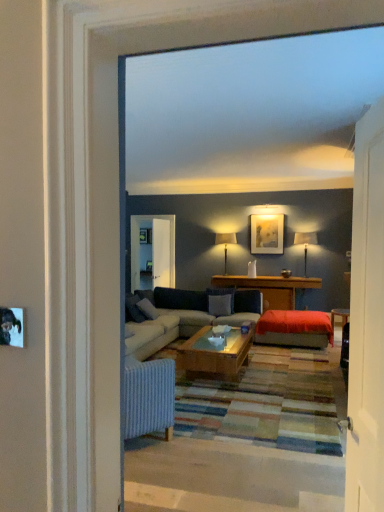
Question: Can you confirm if matte gold picture frame at upper center is wider than wooden table at center?

Choices:
 (A) yes
 (B) no

Answer: (B)

Question: Considering the relative positions of matte gold picture frame at upper center and wooden table at center in the image provided, is matte gold picture frame at upper center behind wooden table at center?

Choices:
 (A) yes
 (B) no

Answer: (A)

Question: Is wooden table at center at the back of matte gold picture frame at upper center?

Choices:
 (A) yes
 (B) no

Answer: (B)

Question: Could wooden table at center be considered to be inside matte gold picture frame at upper center?

Choices:
 (A) no
 (B) yes

Answer: (A)

Question: Can you confirm if matte gold picture frame at upper center is smaller than wooden table at center?

Choices:
 (A) no
 (B) yes

Answer: (B)

Question: In the image, is white wooden door at right positioned in front of or behind matte black lampshade at center, which ranks as the first lamp in left-to-right order?

Choices:
 (A) behind
 (B) front

Answer: (B)

Question: Is white wooden door at right taller or shorter than matte black lampshade at center, marked as the first lamp in a back-to-front arrangement?

Choices:
 (A) short
 (B) tall

Answer: (B)

Question: Considering the positions of white wooden door at right and matte black lampshade at center, which ranks as the first lamp in left-to-right order, in the image, is white wooden door at right wider or thinner than matte black lampshade at center, which ranks as the first lamp in left-to-right order,?

Choices:
 (A) wide
 (B) thin

Answer: (B)

Question: From a real-world perspective, is white wooden door at right positioned above or below matte black lampshade at center, marked as the first lamp in a back-to-front arrangement?

Choices:
 (A) above
 (B) below

Answer: (B)

Question: Visually, is clear glass screen door at center positioned to the left or to the right of matte gold picture frame at upper center?

Choices:
 (A) left
 (B) right

Answer: (A)

Question: Relative to matte gold picture frame at upper center, is clear glass screen door at center in front or behind?

Choices:
 (A) front
 (B) behind

Answer: (A)

Question: From a real-world perspective, relative to matte gold picture frame at upper center, is clear glass screen door at center vertically above or below?

Choices:
 (A) above
 (B) below

Answer: (B)

Question: From the image's perspective, is clear glass screen door at center above or below matte gold picture frame at upper center?

Choices:
 (A) below
 (B) above

Answer: (A)

Question: From a real-world perspective, is matte black lampshade at center, which is the 2th lamp in front-to-back order, physically located above or below matte gold picture frame at upper center?

Choices:
 (A) below
 (B) above

Answer: (A)

Question: Considering the positions of matte black lampshade at center, marked as the first lamp in a back-to-front arrangement, and matte gold picture frame at upper center in the image, is matte black lampshade at center, marked as the first lamp in a back-to-front arrangement, taller or shorter than matte gold picture frame at upper center?

Choices:
 (A) tall
 (B) short

Answer: (A)